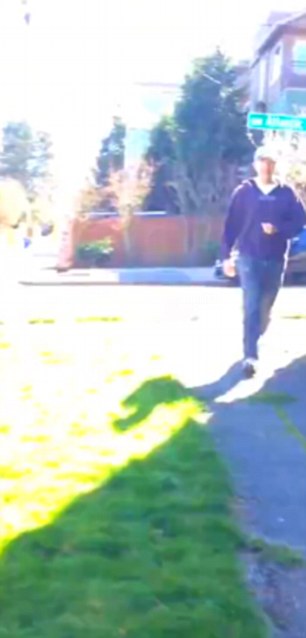
This screenshot has width=306, height=638. Identify the location of windows. (271, 68), (298, 70).